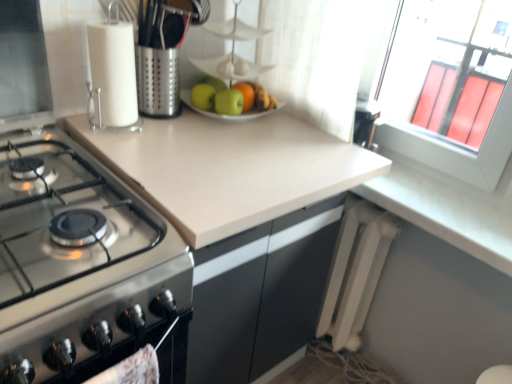
You are a GUI agent. You are given a task and a screenshot of the screen. Output one action in this format:
    pyautogui.click(x=<x>, y=<y>)
    Task: Click on the vacant space in front of green matte apple at center, the first apple when ordered from left to right
    
    Given the screenshot: What is the action you would take?
    pyautogui.click(x=192, y=129)